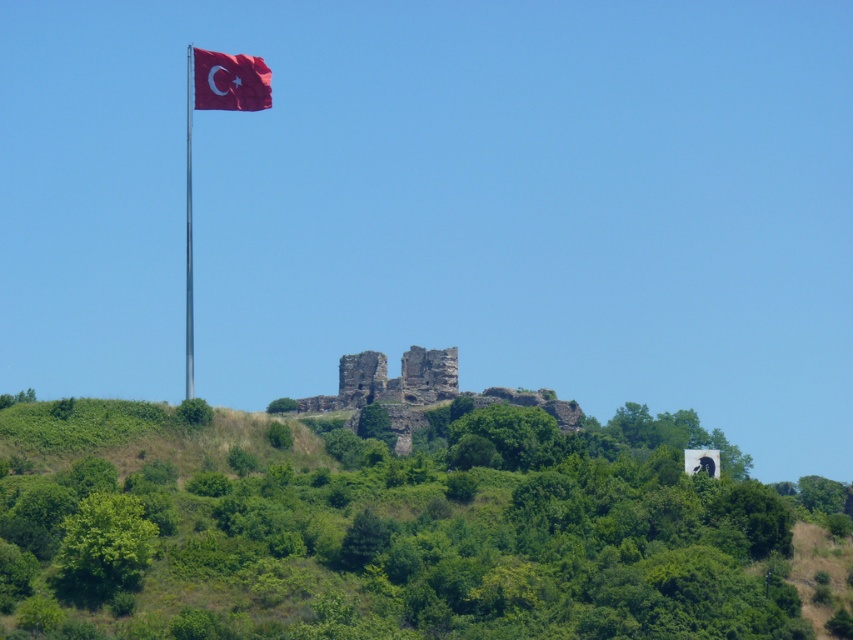
You are a hiker who wants to take a photo of the rustic stone castle at center without any obstructions. Given the green leafy hillside at center is blocking the view, can you suggest a direction to move to get an unobstructed view?

The green leafy hillside at center is in front of rustic stone castle at center, so moving to either the left or right side of the green leafy hillside at center would allow you to see the rustic stone castle at center without obstruction.

From the picture: You are a tourist visiting the area and want to take a photo of both the green leafy hillside at center and the rustic stone castle at center. Based on their positions, which one should you focus on first to ensure both are in frame?

The green leafy hillside at center is to the right of rustic stone castle at center, so you should focus on the rustic stone castle at center first to ensure both are in frame.

Based on the scene description, what does the point at coordinates [387,540] represent?

The point at coordinates [387,540] represents the green leafy hillside at center.